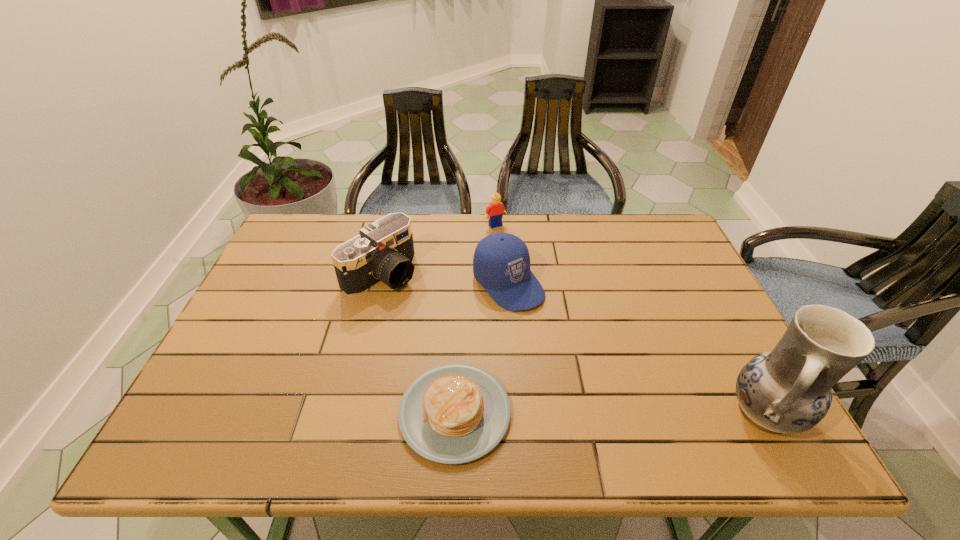
Find the location of a particular element. vacant space that's between the tallest object and the leftmost object is located at coordinates (574, 344).

Point out which object is positioned as the fourth nearest to the pottery. Please provide its 2D coordinates. Your answer should be formatted as a tuple, i.e. [(x, y)], where the tuple contains the x and y coordinates of a point satisfying the conditions above.

[(383, 252)]

I want to click on object that is the third closest to the cap, so click(x=456, y=413).